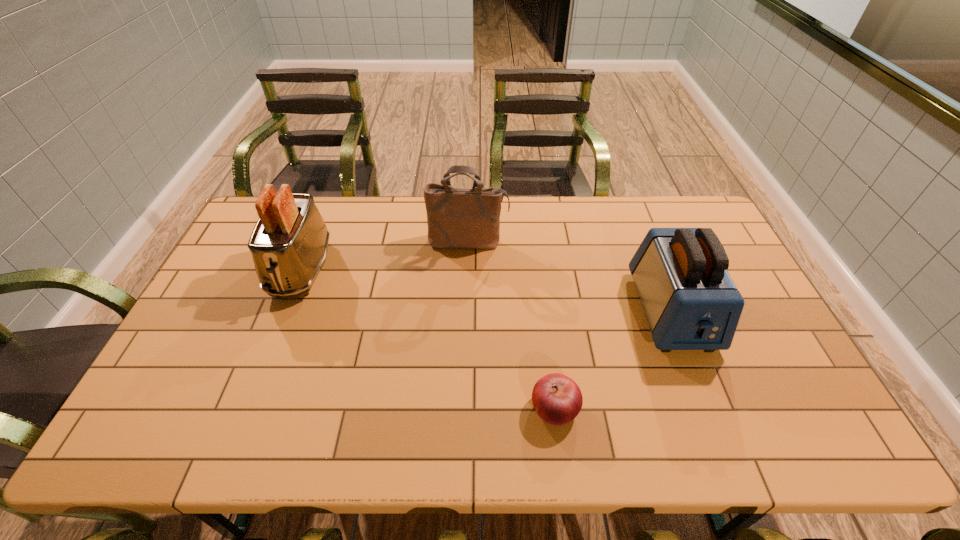
At what (x,y) coordinates should I click in order to perform the action: click on free spot between the right toaster and the left toaster. Please return your answer as a coordinate pair (x, y). Image resolution: width=960 pixels, height=540 pixels. Looking at the image, I should click on (487, 290).

At what (x,y) coordinates should I click in order to perform the action: click on vacant space in between the second object from right to left and the right toaster. Please return your answer as a coordinate pair (x, y). Image resolution: width=960 pixels, height=540 pixels. Looking at the image, I should click on (612, 360).

This screenshot has width=960, height=540. In order to click on vacant space that is in between the shoulder bag and the nearest object in this screenshot , I will do `click(512, 325)`.

Find the location of a particular element. Image resolution: width=960 pixels, height=540 pixels. unoccupied area between the shortest object and the second object from left to right is located at coordinates (512, 325).

Identify the location of free spot between the rightmost object and the second object from left to right. This screenshot has height=540, width=960. (569, 276).

The image size is (960, 540). I want to click on free space between the third object from right to left and the nearest object, so click(512, 325).

Locate an element on the screen. The width and height of the screenshot is (960, 540). vacant area that lies between the shoulder bag and the leftmost object is located at coordinates (385, 255).

Locate an element on the screen. The image size is (960, 540). free space between the third object from right to left and the nearest object is located at coordinates 512,325.

Find the location of a particular element. empty location between the rightmost object and the shoulder bag is located at coordinates (569, 276).

This screenshot has width=960, height=540. I want to click on empty space between the third object from left to right and the left toaster, so click(428, 339).